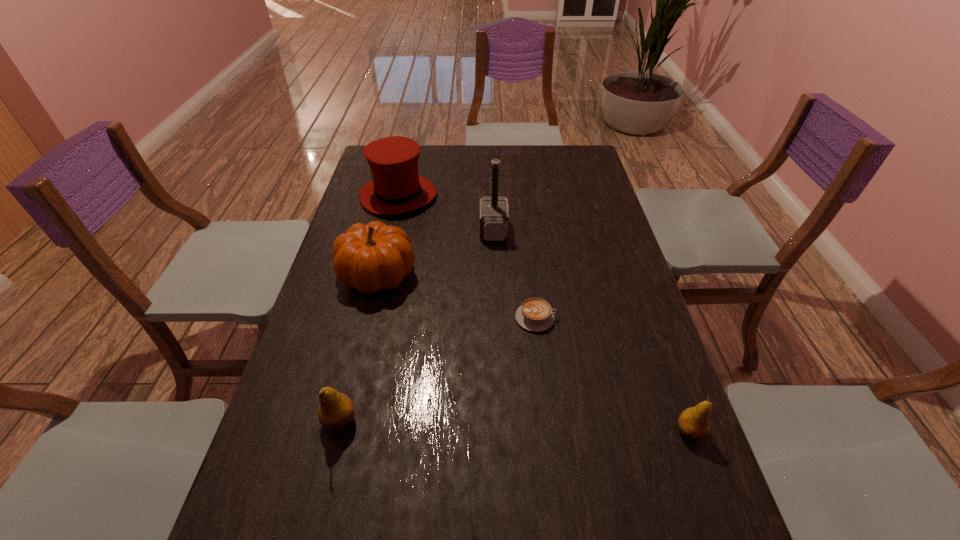
Locate an element on the screen. the left pear is located at coordinates (x=336, y=411).

The image size is (960, 540). I want to click on the rightmost object, so click(x=693, y=422).

The height and width of the screenshot is (540, 960). Identify the location of the shorter pear. (693, 422).

Where is `hammer`? This screenshot has height=540, width=960. hammer is located at coordinates (494, 214).

Where is `the third object from right to left`? the third object from right to left is located at coordinates (494, 214).

At what (x,y) coordinates should I click in order to perform the action: click on hat. Please return your answer as a coordinate pair (x, y). Image resolution: width=960 pixels, height=540 pixels. Looking at the image, I should click on (396, 188).

Where is `cappuccino`? cappuccino is located at coordinates (535, 314).

The image size is (960, 540). I want to click on the shortest object, so point(535,314).

Where is `the third farthest object`? the third farthest object is located at coordinates (372, 257).

Locate an element on the screen. This screenshot has height=540, width=960. free spot located on the back of the left pear is located at coordinates (352, 371).